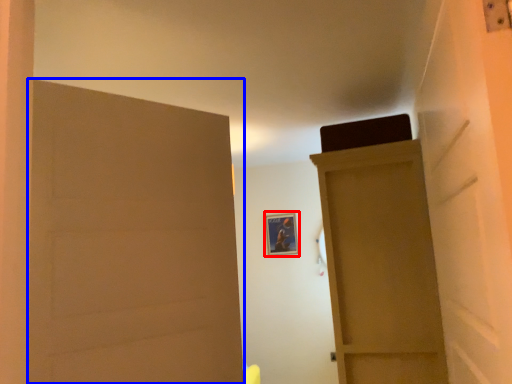
Question: Which object is further to the camera taking this photo, picture frame (highlighted by a red box) or door (highlighted by a blue box)?

Choices:
 (A) picture frame
 (B) door

Answer: (A)